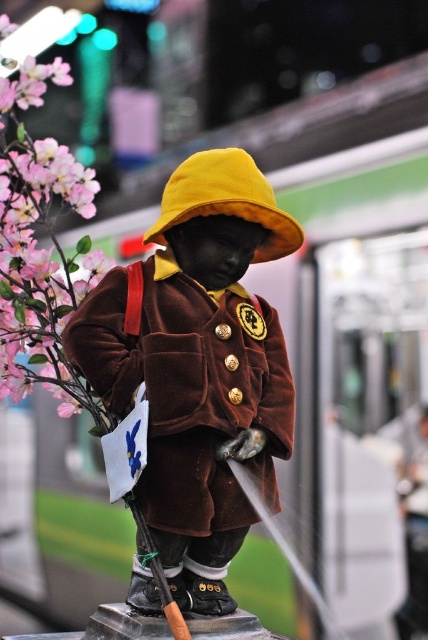
You are a fashion designer observing the statue of Paddington Bear. You notice the velvet brown coat at center and the matte pink petals at left. Which object is smaller in size?

The velvet brown coat at center is smaller in size compared to the matte pink petals at left.

You are standing in front of the statue of Paddington Bear and want to place two markers at the coordinates point (223, 250) and point (62, 266). Which marker will be closer to you when viewed from your current position?

Point (223, 250) is in front of point (62, 266), so the marker at point (223, 250) will be closer to you.